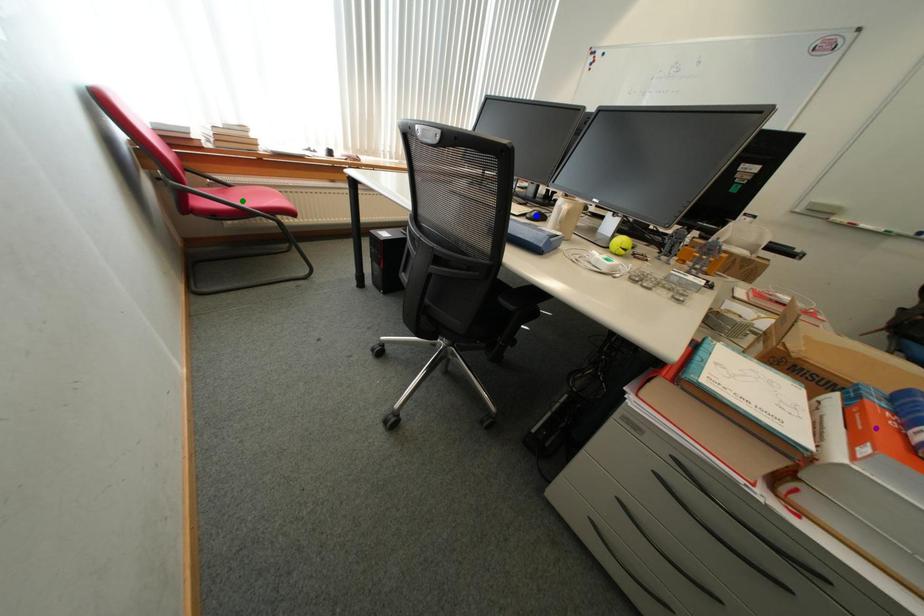
Order these from nearest to farthest:
- green point
- purple point
- blue point

purple point → blue point → green point